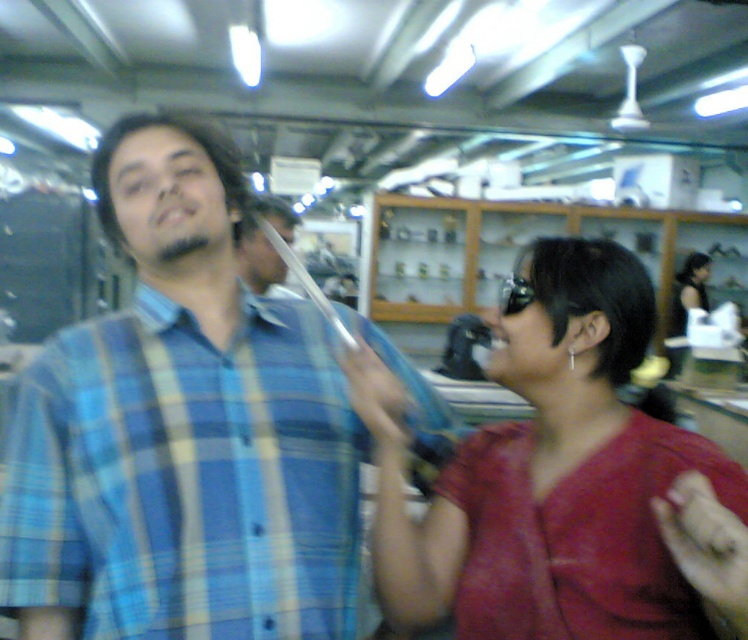
You are a photographer setting up a camera to capture the two people in the scene. The camera has a limited focus width. You need to ensure both the blue plaid shirt at center and the shiny red fabric at center are in focus. Based on their positions, do you think the focus width will be sufficient to include both?

The blue plaid shirt at center might be wider than shiny red fabric at center, so the focus width may not be sufficient to include both if the camera can only focus on one width at a time. Adjust the focus area or position to ensure both are within the focus range.

You are a photographer trying to capture a closeup of the shiny red fabric at center and the smooth black hair at center. Since you want to focus on the fabric, should you adjust your camera to have a shallow depth of field to blur the background?

Yes, adjusting the camera to a shallow depth of field would blur the background, including the smooth black hair at center, allowing the shiny red fabric at center to be the main focus.

You are standing at the point labeled as point (180, 324) in a retail store. You want to take a photo of the display cases in the background using your phone, which has a maximum zoom range of 2 meters. Can you capture the entire display cases in your photo without moving closer?

The point labeled as point (180, 324) is 1.03 meters away from the camera. Since the maximum zoom range of your phone is 2 meters, you can capture the entire display cases in your photo without moving closer.